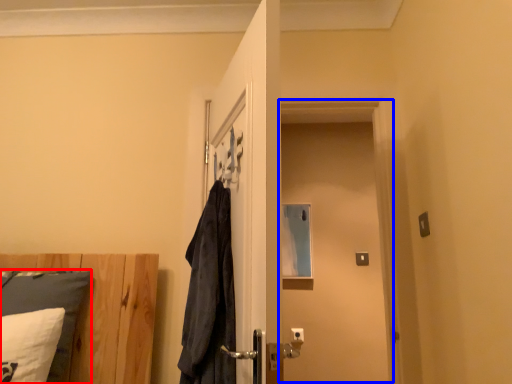
Question: Which point is closer to the camera, pillow (highlighted by a red box) or screen door (highlighted by a blue box)?

Choices:
 (A) pillow
 (B) screen door

Answer: (A)